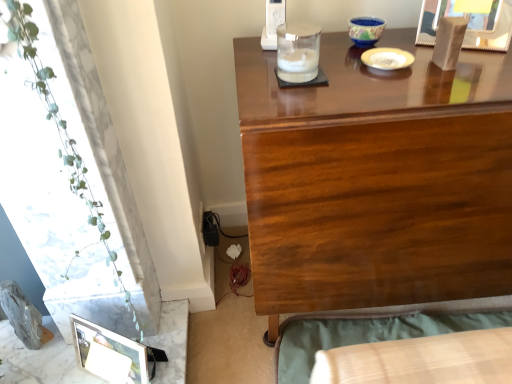
Question: Is green leafy plant at left outside white glossy plate at upper center?

Choices:
 (A) yes
 (B) no

Answer: (A)

Question: Considering the relative sizes of green leafy plant at left and white glossy plate at upper center in the image provided, is green leafy plant at left wider than white glossy plate at upper center?

Choices:
 (A) yes
 (B) no

Answer: (A)

Question: Does green leafy plant at left contain white glossy plate at upper center?

Choices:
 (A) yes
 (B) no

Answer: (B)

Question: From the image's perspective, would you say green leafy plant at left is shown under white glossy plate at upper center?

Choices:
 (A) no
 (B) yes

Answer: (B)

Question: Is green leafy plant at left aimed at white glossy plate at upper center?

Choices:
 (A) no
 (B) yes

Answer: (A)

Question: Looking at the image, does blue ceramic bowl at upper center, the first candle holder when ordered from top to bottom, seem bigger or smaller compared to glossy wood desk at upper center?

Choices:
 (A) small
 (B) big

Answer: (A)

Question: Considering the positions of point (370, 18) and point (415, 135), is point (370, 18) closer or farther from the camera than point (415, 135)?

Choices:
 (A) farther
 (B) closer

Answer: (A)

Question: In terms of height, does blue ceramic bowl at upper center, which ranks as the 2th candle holder in left-to-right order, look taller or shorter compared to glossy wood desk at upper center?

Choices:
 (A) short
 (B) tall

Answer: (A)

Question: Choose the correct answer: Is blue ceramic bowl at upper center, positioned as the first candle holder in right-to-left order, inside glossy wood desk at upper center or outside it?

Choices:
 (A) outside
 (B) inside

Answer: (A)

Question: From a real-world perspective, is glossy wood desk at upper center physically located above or below wooden bed frame at lower right?

Choices:
 (A) below
 (B) above

Answer: (B)

Question: In terms of width, does glossy wood desk at upper center look wider or thinner when compared to wooden bed frame at lower right?

Choices:
 (A) wide
 (B) thin

Answer: (B)

Question: Is point (301, 187) positioned closer to the camera than point (338, 321)?

Choices:
 (A) closer
 (B) farther

Answer: (A)

Question: Considering their positions, is glossy wood desk at upper center located in front of or behind wooden bed frame at lower right?

Choices:
 (A) front
 (B) behind

Answer: (A)

Question: Is metallic silver picture frame at lower left, placed as the 1th picture frame when sorted from left to right, bigger or smaller than wooden bed frame at lower right?

Choices:
 (A) small
 (B) big

Answer: (A)

Question: Considering the positions of point (123, 362) and point (326, 314), is point (123, 362) closer or farther from the camera than point (326, 314)?

Choices:
 (A) closer
 (B) farther

Answer: (A)